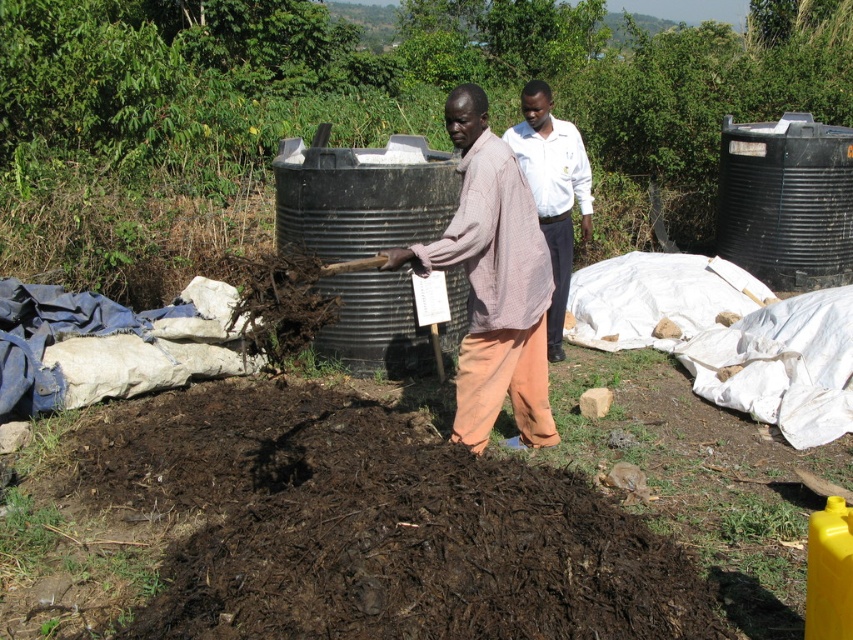
Question: Which of the following is the farthest from the observer?

Choices:
 (A) pos(555,353)
 (B) pos(538,348)

Answer: (A)

Question: Does light brown woven shirt at center appear on the left side of white shirt at center?

Choices:
 (A) no
 (B) yes

Answer: (B)

Question: Which point is closer to the camera?

Choices:
 (A) dark brown organic matter at center
 (B) white shirt at center
 (C) light brown woven shirt at center

Answer: (A)

Question: Observing the image, what is the correct spatial positioning of dark brown organic matter at center in reference to white shirt at center?

Choices:
 (A) below
 (B) above

Answer: (A)

Question: Is dark brown organic matter at center wider than white shirt at center?

Choices:
 (A) no
 (B) yes

Answer: (B)

Question: Among these objects, which one is farthest from the camera?

Choices:
 (A) light brown woven shirt at center
 (B) dark brown organic matter at center

Answer: (A)